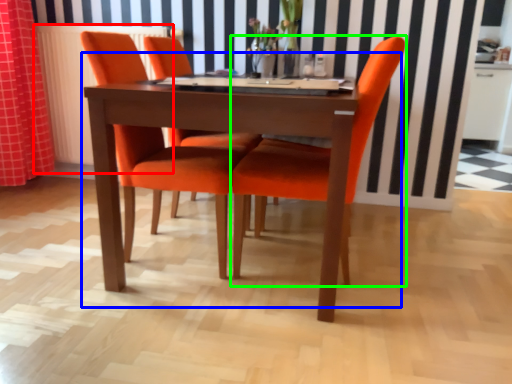
Question: Based on their relative distances, which object is farther from radiator (highlighted by a red box)? Choose from kitchen & dining room table (highlighted by a blue box) and chair (highlighted by a green box).

Choices:
 (A) kitchen & dining room table
 (B) chair

Answer: (B)